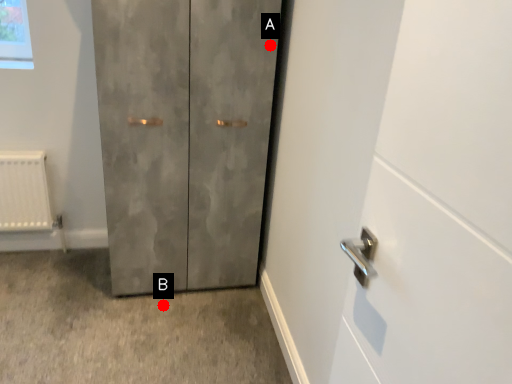
Question: Two points are circled on the image, labeled by A and B beside each circle. Which point is farther from the camera taking this photo?

Choices:
 (A) A is further
 (B) B is further

Answer: (B)